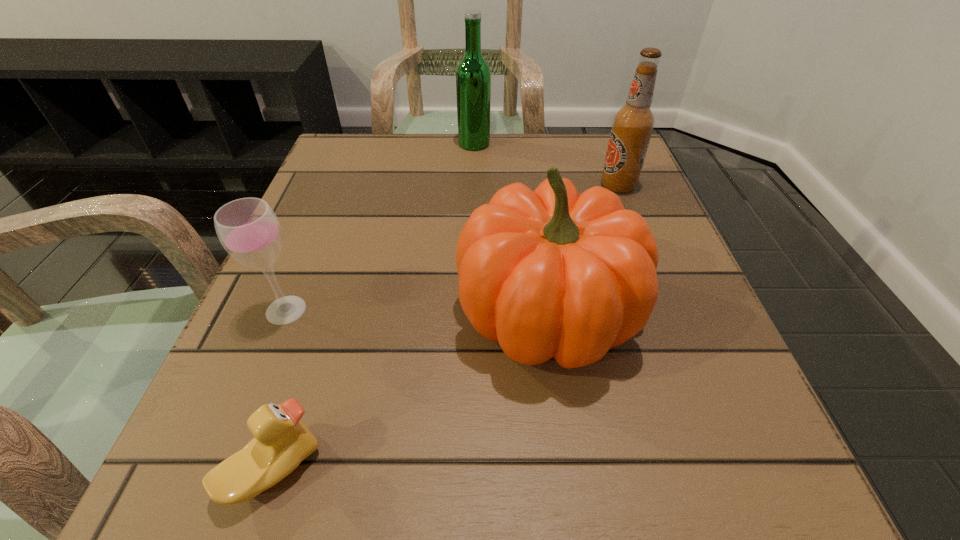
This screenshot has width=960, height=540. I want to click on the farther beer bottle, so click(x=473, y=75).

Locate an element on the screen. The image size is (960, 540). the farthest object is located at coordinates (473, 75).

Find the location of a particular element. Image resolution: width=960 pixels, height=540 pixels. the nearer beer bottle is located at coordinates tap(632, 126).

At what (x,y) coordinates should I click in order to perform the action: click on the fourth nearest object. Please return your answer as a coordinate pair (x, y). This screenshot has height=540, width=960. Looking at the image, I should click on (632, 126).

You are a GUI agent. You are given a task and a screenshot of the screen. Output one action in this format:
    pyautogui.click(x=<x>, y=<y>)
    Task: Click on the pumpkin
    Image resolution: width=960 pixels, height=540 pixels.
    Given the screenshot: What is the action you would take?
    pyautogui.click(x=549, y=273)

The image size is (960, 540). What are the coordinates of `wineglass` in the screenshot? It's located at 248,229.

I want to click on the nearest object, so click(281, 441).

Find the location of `the shortest object`. the shortest object is located at coordinates (281, 441).

You are a GUI agent. You are given a task and a screenshot of the screen. Output one action in this format:
    pyautogui.click(x=<x>, y=<y>)
    Task: Click on the free space located on the left of the left beer bottle
    The width and height of the screenshot is (960, 540).
    Given the screenshot: What is the action you would take?
    pyautogui.click(x=412, y=144)

At what (x,y) coordinates should I click in order to perform the action: click on vacant area situated 0.180m on the front label of the right beer bottle. Please return your answer as a coordinate pair (x, y). The image size is (960, 540). Looking at the image, I should click on (514, 186).